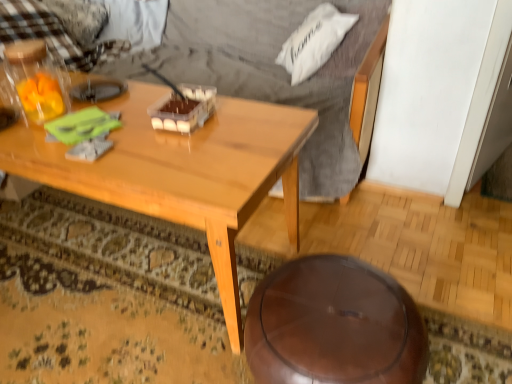
The height and width of the screenshot is (384, 512). In order to click on vacant area that is in front of translucent plastic container at center in this screenshot , I will do `click(184, 144)`.